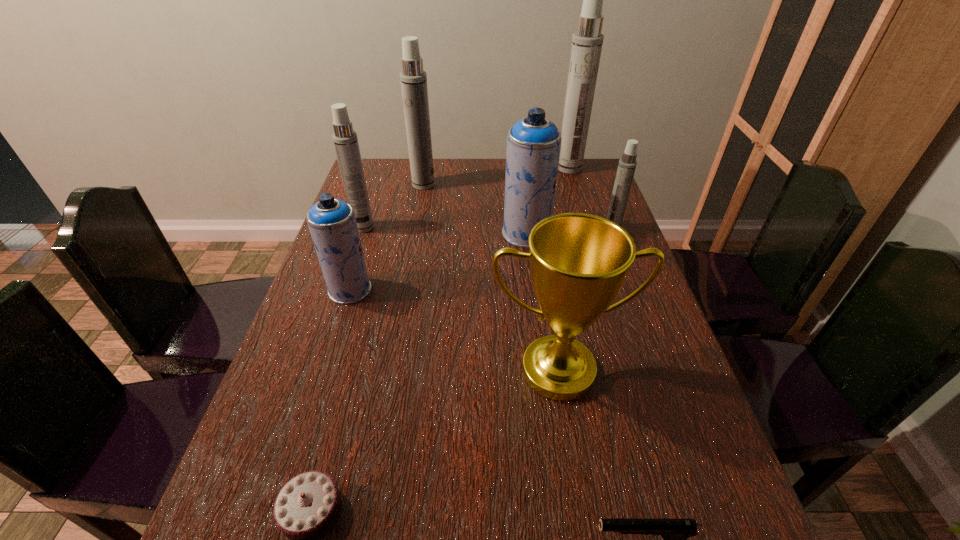
You are a GUI agent. You are given a task and a screenshot of the screen. Output one action in this format:
    pyautogui.click(x=<x>, y=<y>)
    Task: Click on the smallest white aerosol can
    Image resolution: width=960 pixels, height=540 pixels.
    Given the screenshot: What is the action you would take?
    pyautogui.click(x=627, y=164)

The image size is (960, 540). I want to click on the nearer blue aerosol can, so click(332, 223).

Identify the location of the left blue aerosol can. (332, 223).

This screenshot has width=960, height=540. Find the location of `blank area located on the left of the tallest object`. blank area located on the left of the tallest object is located at coordinates (489, 168).

Image resolution: width=960 pixels, height=540 pixels. I want to click on free space located 0.080m on the front of the second tallest object, so click(420, 204).

What are the coordinates of `vacant space located 0.340m on the right of the leftmost white aerosol can` in the screenshot? It's located at (490, 227).

You are a GUI agent. You are given a task and a screenshot of the screen. Output one action in this format:
    pyautogui.click(x=<x>, y=<y>)
    Task: Click on the blank space located on the right of the bigger blue aerosol can
    Image resolution: width=960 pixels, height=540 pixels.
    Given the screenshot: What is the action you would take?
    pyautogui.click(x=596, y=233)

At what (x,y) coordinates should I click in order to perform the action: click on vacant space located by the handles of the gold award. Please return your answer as a coordinate pair (x, y). The width and height of the screenshot is (960, 540). Looking at the image, I should click on (578, 497).

I want to click on vacant space located 0.310m on the left of the rightmost object, so click(499, 228).

At what (x,y) coordinates should I click in order to perform the action: click on blank area located on the front of the left blue aerosol can. Please return your answer as a coordinate pair (x, y). This screenshot has height=540, width=960. Looking at the image, I should click on (334, 340).